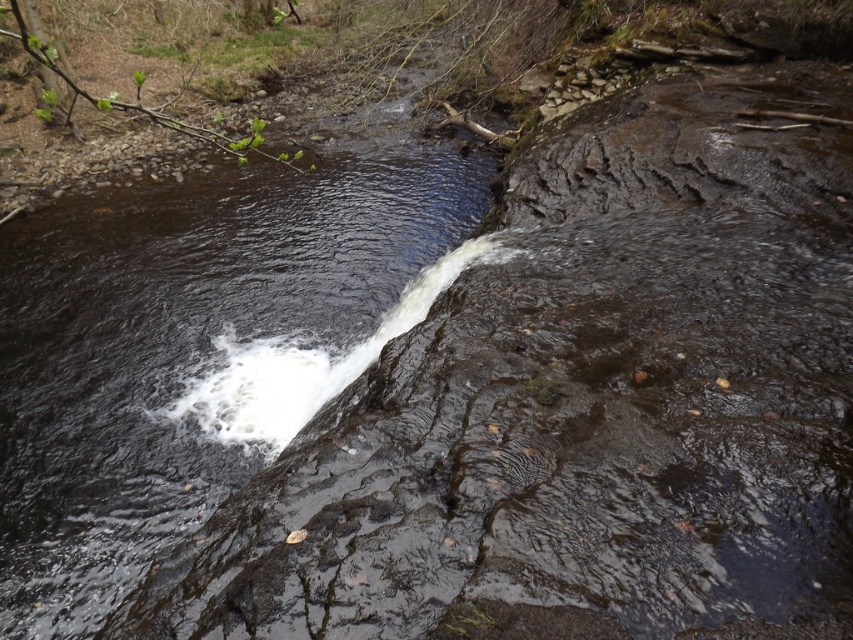
You are standing at the edge of the stream and notice the dark wet rock at center. Based on its position, can you determine if it is closer to the waterfall or the downstream area?

The dark wet rock at center is located at point [194,348], which places it closer to the downstream area rather than the waterfall.

You are a hiker trying to cross the stream at the center of the image. You see the dark wet rock at center and the white frothy water at center. Which one is wider, and can you safely step on the wider one?

The dark wet rock at center might be wider than white frothy water at center. Since the rock is wider and solid, it is safer to step on the dark wet rock at center.

You are standing at the point labeled as point (194, 348) in the image. What type of surface are you currently standing on?

You are standing on dark wet rock at center.